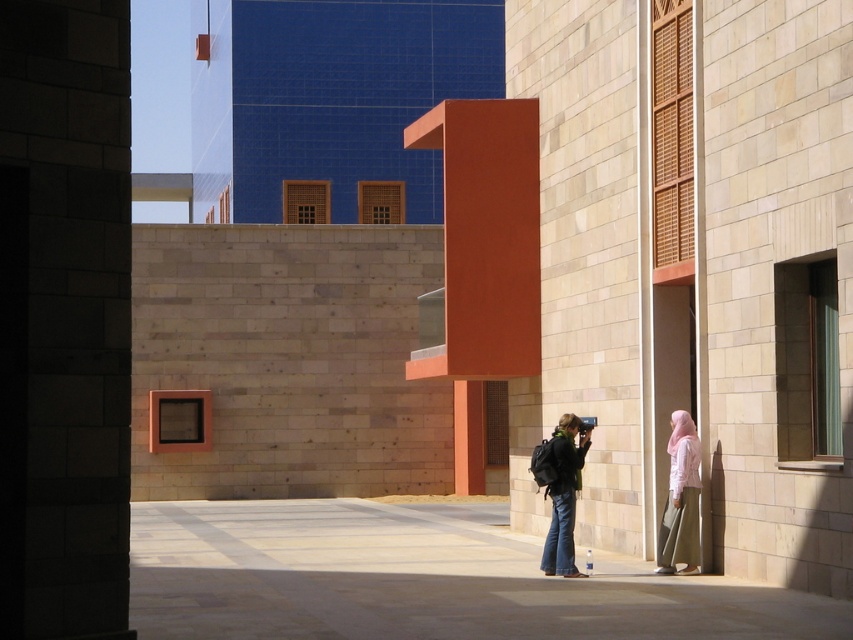
Based on the photo, you are standing at the point indicated by the coordinates point (483, 259). Looking around, you see the matte orange pillar at center. Which direction should you walk to reach the blue section with geometric design?

The blue section with geometric design is located to the left of the matte orange pillar at center. Therefore, you should walk towards the left from the point (483, 259) to reach the blue section with geometric design.

You are a fashion designer observing the scene. You need to determine which item of clothing is smaller in size between the pale pink fabric hijab at lower right and the denim jeans at center. Which one is smaller?

The pale pink fabric hijab at lower right has a smaller size compared to the denim jeans at center, so the pale pink fabric hijab at lower right is smaller.